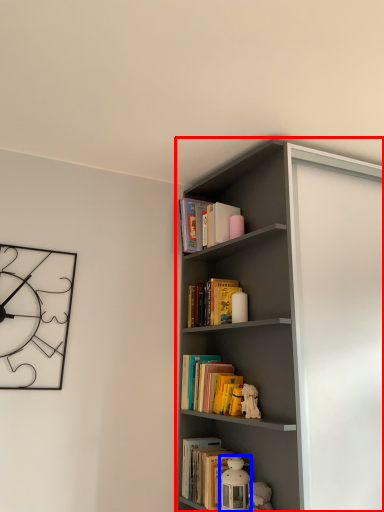
Question: Which object is closer to the camera taking this photo, shelf (highlighted by a red box) or toy (highlighted by a blue box)?

Choices:
 (A) shelf
 (B) toy

Answer: (A)